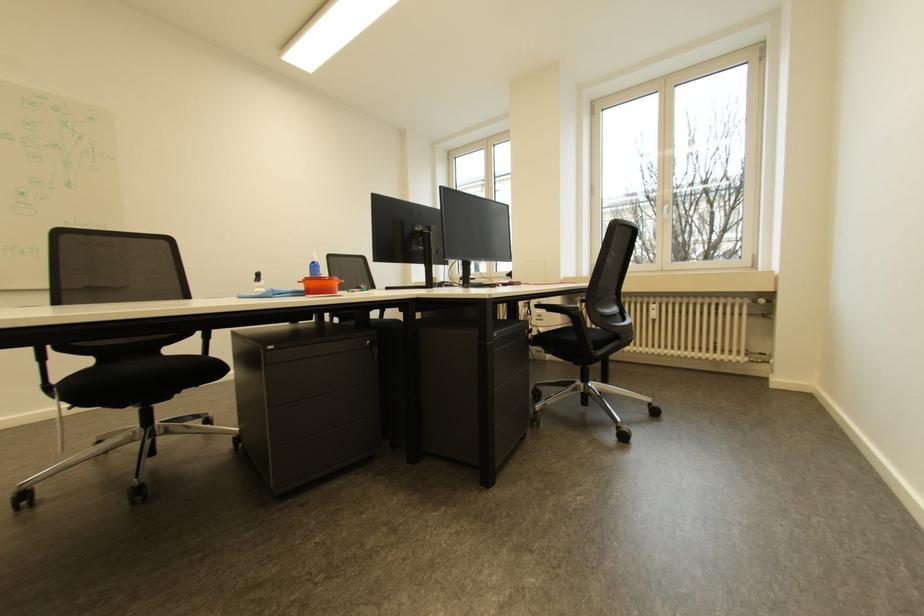
Locate an element on the screen. This screenshot has height=616, width=924. blue spray bottle is located at coordinates (313, 265).